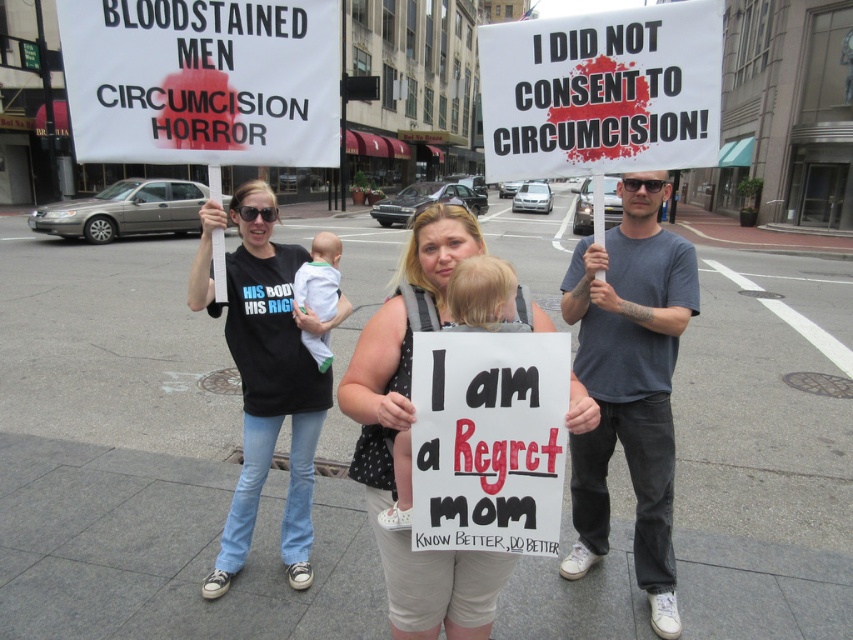
You are a photographer at the protest scene. You need to capture a photo where both the soft beige fabric baby at center and the white cotton baby at center are visible. Which baby should you focus on to ensure the taller one is in frame?

The white cotton baby at center is taller than the soft beige fabric baby at center, so focusing on the white cotton baby at center ensures the taller one is in frame.

You are a photographer at the protest scene. You need to capture a clear photo of both the soft beige fabric baby at center and the white cotton baby at center. Which baby is closer to the camera?

Result: The soft beige fabric baby at center is positioned under the white cotton baby at center, so the white cotton baby at center is closer to the camera.

Consider the image. You are a photographer standing in front of the protest scene. You want to take a closeup photo of the soft beige fabric baby at center. Considering the distance, is it possible to capture the baby clearly without moving closer?

The soft beige fabric baby at center is 5.63 feet away from viewer. At this distance, a photographer can likely capture the baby clearly using a zoom lens without needing to move closer.